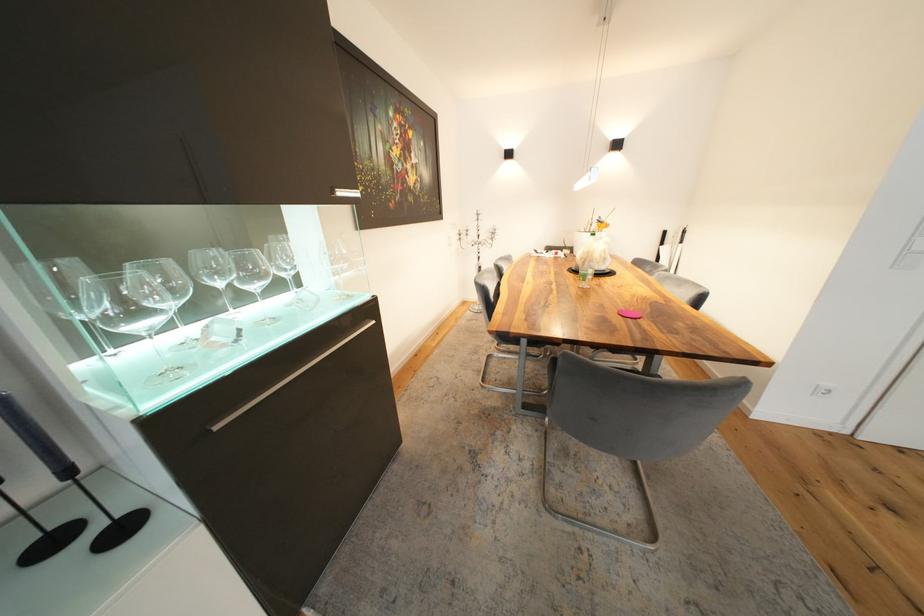
The width and height of the screenshot is (924, 616). What do you see at coordinates (628, 369) in the screenshot?
I see `a grey chair sitting surface` at bounding box center [628, 369].